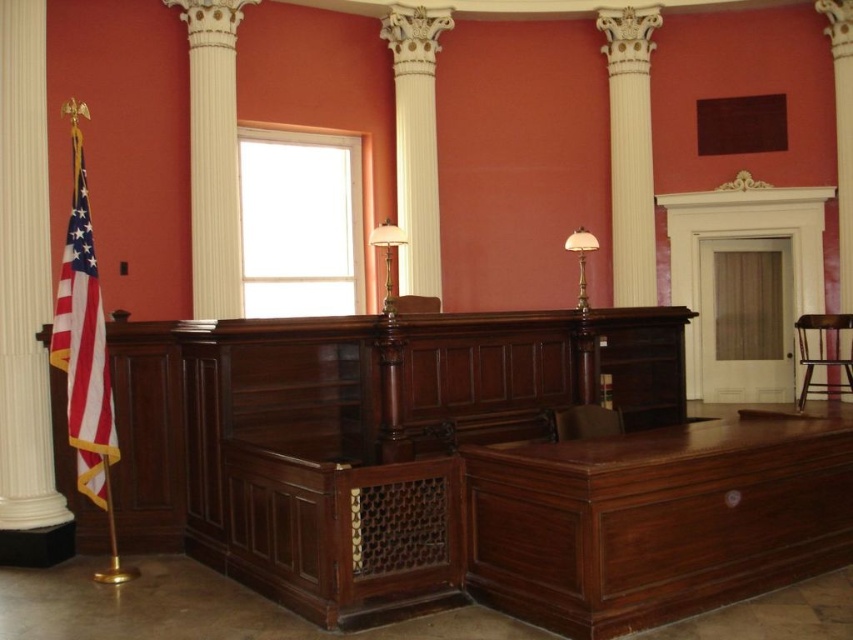
Does white glossy column at upper left have a larger size compared to white glossy column at upper center?

No.

Is white glossy column at upper left to the left of white glossy column at upper center from the viewer's perspective?

Correct, you'll find white glossy column at upper left to the left of white glossy column at upper center.

Identify the location of white glossy column at upper left. (213, 154).

The width and height of the screenshot is (853, 640). Find the location of `white glossy column at upper left`. white glossy column at upper left is located at coordinates (213, 154).

Where is `red-white-striped fabric flag at left`? The height and width of the screenshot is (640, 853). red-white-striped fabric flag at left is located at coordinates (83, 342).

Is red-white-striped fabric flag at left thinner than brown wood chair at lower center?

No, red-white-striped fabric flag at left is not thinner than brown wood chair at lower center.

What are the coordinates of `red-white-striped fabric flag at left` in the screenshot? It's located at (83, 342).

Where is `red-white-striped fabric flag at left`? The height and width of the screenshot is (640, 853). red-white-striped fabric flag at left is located at coordinates (83, 342).

Which is behind, point (74, 428) or point (576, 236)?

Point (576, 236)

Based on the photo, is red-white-striped fabric flag at left to the right of translucent glass lamp at center from the viewer's perspective?

In fact, red-white-striped fabric flag at left is to the left of translucent glass lamp at center.

At what (x,y) coordinates should I click in order to perform the action: click on red-white-striped fabric flag at left. Please return your answer as a coordinate pair (x, y). The image size is (853, 640). Looking at the image, I should click on (83, 342).